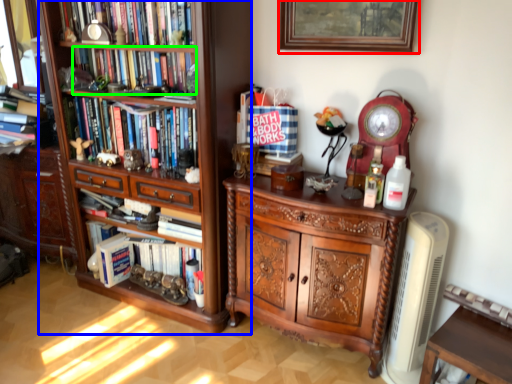
Question: Which object is positioned farthest from picture frame (highlighted by a red box)? Select from shelf (highlighted by a blue box) and book (highlighted by a green box).

Choices:
 (A) shelf
 (B) book

Answer: (B)